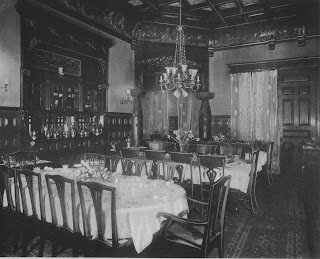
You are a GUI agent. You are given a task and a screenshot of the screen. Output one action in this format:
    pyautogui.click(x=<x>, y=<y>)
    Task: Click on the light
    Image resolution: width=320 pixels, height=259 pixels.
    Given the screenshot: What is the action you would take?
    pyautogui.click(x=174, y=82)